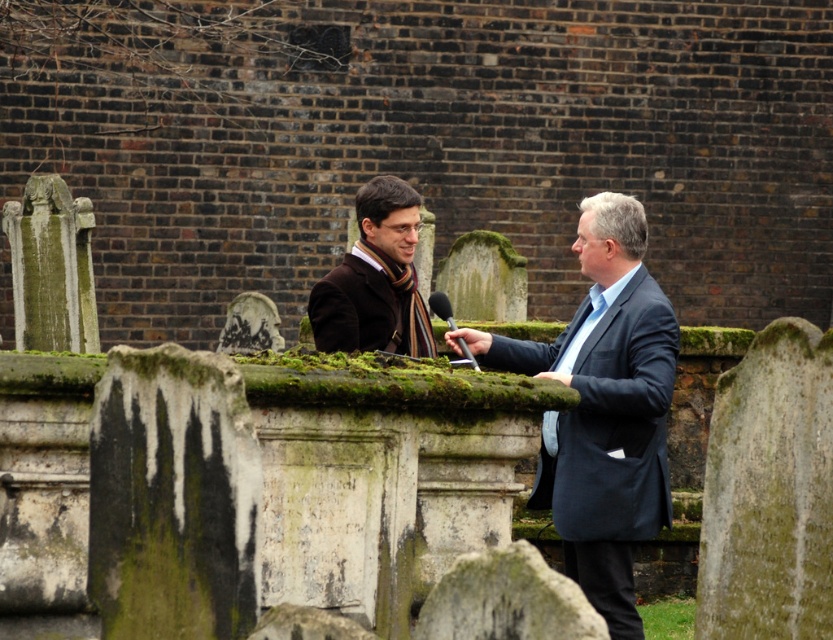
Who is taller, dark blue suit at center or metallic silver microphone at center?

dark blue suit at center

Is dark blue suit at center shorter than metallic silver microphone at center?

In fact, dark blue suit at center may be taller than metallic silver microphone at center.

This screenshot has height=640, width=833. Identify the location of dark blue suit at center. (605, 410).

At what (x,y) coordinates should I click in order to perform the action: click on dark blue suit at center. Please return your answer as a coordinate pair (x, y). The height and width of the screenshot is (640, 833). Looking at the image, I should click on (605, 410).

Can you confirm if dark blue suit at center is shorter than matte brown coat at center?

→ No.

This screenshot has width=833, height=640. What do you see at coordinates (605, 410) in the screenshot? I see `dark blue suit at center` at bounding box center [605, 410].

Identify the location of dark blue suit at center. (605, 410).

Does point (413, 346) come farther from viewer compared to point (486, 352)?

Yes, it is.

Locate an element on the screen. This screenshot has height=640, width=833. matte brown coat at center is located at coordinates (375, 280).

Which is behind, point (347, 321) or point (475, 333)?

Point (475, 333)

The height and width of the screenshot is (640, 833). I want to click on matte brown coat at center, so click(375, 280).